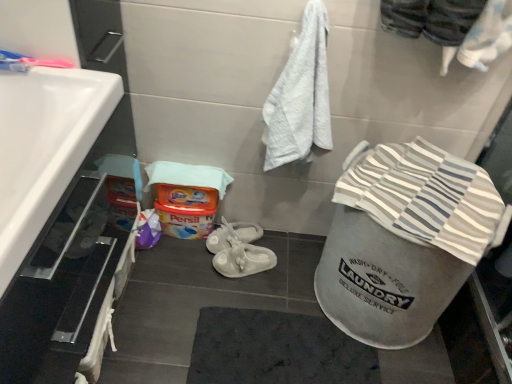
At what (x,y) coordinates should I click in order to perform the action: click on free spot below white rubber sandals at center (from a real-world perspective). Please return your answer as a coordinate pair (x, y). The width and height of the screenshot is (512, 384). Looking at the image, I should click on (249, 271).